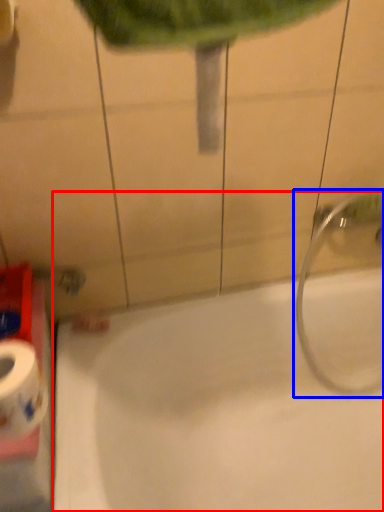
Question: Which point is closer to the camera, bathtub (highlighted by a red box) or plumbing fixture (highlighted by a blue box)?

Choices:
 (A) bathtub
 (B) plumbing fixture

Answer: (A)